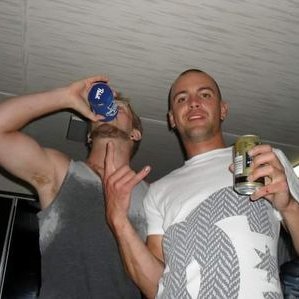
Where is `ceiling`? ceiling is located at coordinates (168, 33).